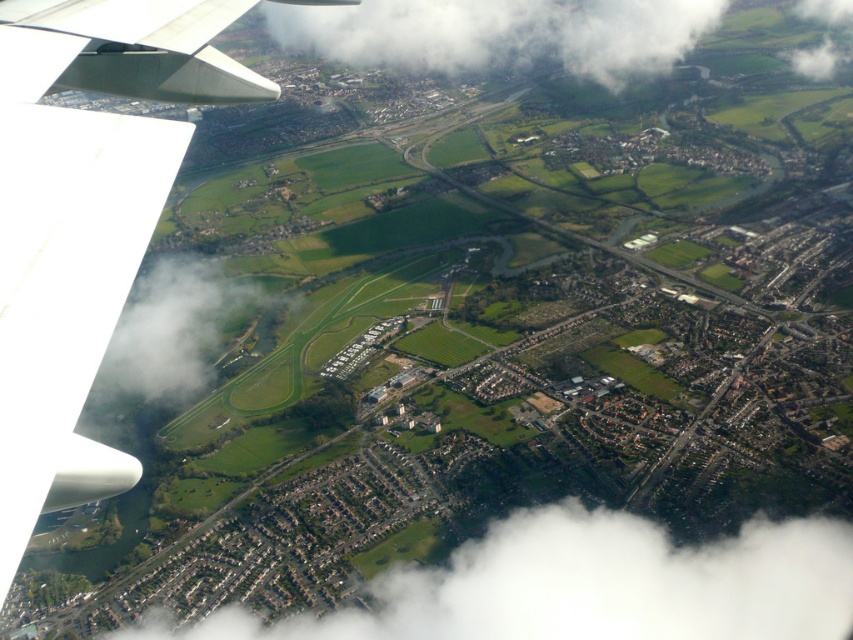
Between white matte wing at upper left and white fluffy cloud at center, which one has less height?

white fluffy cloud at center is shorter.

Does point (51, 420) lie in front of point (357, 35)?

That is True.

The height and width of the screenshot is (640, 853). In order to click on white matte wing at upper left in this screenshot , I will do `click(84, 220)`.

Who is more forward, (x=167, y=81) or (x=728, y=554)?

Point (x=167, y=81) is more forward.

Does white matte wing at upper left appear on the right side of white fluffy cloud at lower center?

In fact, white matte wing at upper left is to the left of white fluffy cloud at lower center.

Who is more distant from viewer, (x=90, y=298) or (x=769, y=634)?

The point (x=769, y=634) is more distant.

Find the location of a particular element. The image size is (853, 640). white matte wing at upper left is located at coordinates (84, 220).

Between white fluffy cloud at lower center and white fluffy cloud at center, which one is positioned lower?

white fluffy cloud at lower center is lower down.

Which is more to the left, white fluffy cloud at lower center or white fluffy cloud at center?

Positioned to the left is white fluffy cloud at lower center.

What do you see at coordinates (592, 586) in the screenshot? I see `white fluffy cloud at lower center` at bounding box center [592, 586].

What are the coordinates of `white fluffy cloud at lower center` in the screenshot? It's located at (592, 586).